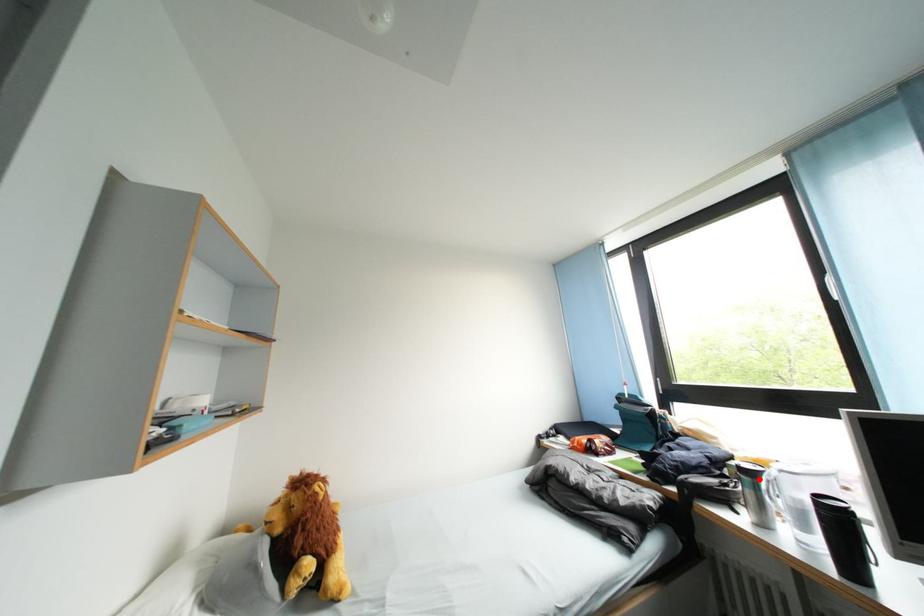
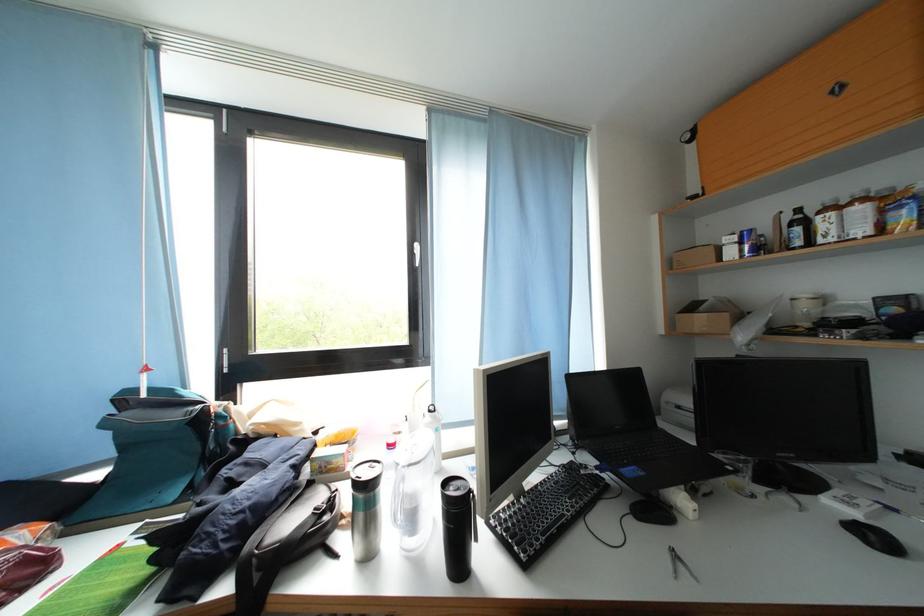
Where in the second image is the point corresponding to the highlighted location from the first image?

(380, 493)